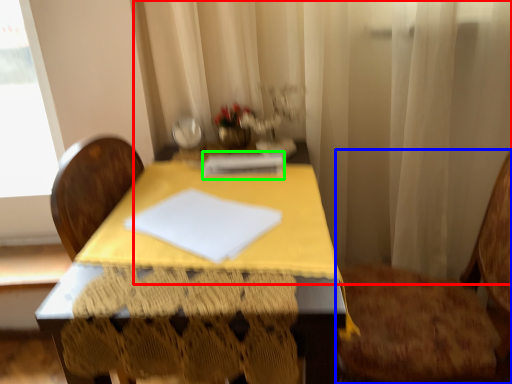
Question: Which object is positioned farthest from curtain (highlighted by a red box)? Select from chair (highlighted by a blue box) and notebook (highlighted by a green box).

Choices:
 (A) chair
 (B) notebook

Answer: (B)